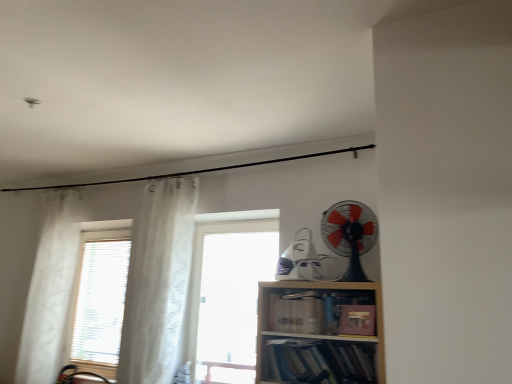
What is the approximate height of matte cardboard book at center-right, the 2th book in the bottom-to-top sequence?

matte cardboard book at center-right, the 2th book in the bottom-to-top sequence, is 8.81 inches in height.

Image resolution: width=512 pixels, height=384 pixels. Describe the element at coordinates (357, 320) in the screenshot. I see `brown leather book at lower right, positioned as the 3th book in bottom-to-top order` at that location.

Describe the element at coordinates (158, 281) in the screenshot. Image resolution: width=512 pixels, height=384 pixels. I see `white sheer curtain at left, arranged as the second curtain when viewed from the left` at that location.

You are a GUI agent. You are given a task and a screenshot of the screen. Output one action in this format:
    pyautogui.click(x=<x>, y=<y>)
    Task: Click on the transparent glass window at center
    Image resolution: width=512 pixels, height=384 pixels.
    Given the screenshot: What is the action you would take?
    pyautogui.click(x=228, y=297)

Measure the distance from white sheer curtain at left, arranged as the second curtain when viewed from the left, to black plastic fan at upper right.

white sheer curtain at left, arranged as the second curtain when viewed from the left, and black plastic fan at upper right are 1.28 meters apart.

In the scene shown: Considering the relative sizes of white sheer curtain at left, which is counted as the first curtain, starting from the right, and black plastic fan at upper right in the image provided, is white sheer curtain at left, which is counted as the first curtain, starting from the right, shorter than black plastic fan at upper right?

No.

Is white sheer curtain at left, which is counted as the first curtain, starting from the right, closer to camera compared to black plastic fan at upper right?

No, white sheer curtain at left, which is counted as the first curtain, starting from the right, is further to the viewer.

Are white sheer curtain at left, which is counted as the first curtain, starting from the right, and black plastic fan at upper right beside each other?

white sheer curtain at left, which is counted as the first curtain, starting from the right, is not next to black plastic fan at upper right, and they're not touching.

Considering the relative sizes of transparent glass window at center and matte cardboard book at center-right, the 2th book in the bottom-to-top sequence, in the image provided, is transparent glass window at center shorter than matte cardboard book at center-right, the 2th book in the bottom-to-top sequence,?

Incorrect, the height of transparent glass window at center does not fall short of that of matte cardboard book at center-right, the 2th book in the bottom-to-top sequence.

Between transparent glass window at center and matte cardboard book at center-right, the 2th book in the bottom-to-top sequence, which one has smaller size?

matte cardboard book at center-right, the 2th book in the bottom-to-top sequence.

Is transparent glass window at center not near matte cardboard book at center-right, the 2th book in the top-to-bottom sequence?

transparent glass window at center is positioned a significant distance from matte cardboard book at center-right, the 2th book in the top-to-bottom sequence.

From a real-world perspective, is transparent glass window at center positioned over matte cardboard book at center-right, the 2th book in the bottom-to-top sequence, based on gravity?

Yes, from a real-world perspective, transparent glass window at center is on top of matte cardboard book at center-right, the 2th book in the bottom-to-top sequence.

Where is `mechanical fan above the white sheer curtain at left, the 2th curtain viewed from the right (from a real-world perspective)`? mechanical fan above the white sheer curtain at left, the 2th curtain viewed from the right (from a real-world perspective) is located at coordinates 350,235.

Relative to white sheer curtain at left, the 2th curtain viewed from the right, is black plastic fan at upper right in front or behind?

black plastic fan at upper right is positioned closer to the viewer than white sheer curtain at left, the 2th curtain viewed from the right.

Is black plastic fan at upper right bigger than white sheer curtain at left, the 2th curtain viewed from the right?

No, black plastic fan at upper right is not bigger than white sheer curtain at left, the 2th curtain viewed from the right.

Is point (359, 280) farther from camera compared to point (384, 381)?

Yes, point (359, 280) is behind point (384, 381).

From the image's perspective, would you say black plastic fan at upper right is shown under wooden bookshelf at center?

Incorrect, from the image's perspective, black plastic fan at upper right is higher than wooden bookshelf at center.

Between black plastic fan at upper right and wooden bookshelf at center, which one appears on the left side from the viewer's perspective?

Positioned to the left is wooden bookshelf at center.

From a real-world perspective, which is physically above, transparent glass window at center or brown leather book at lower right, acting as the 1th book starting from the top?

In real-world perspective, transparent glass window at center is above.

Can you confirm if transparent glass window at center is positioned to the right of brown leather book at lower right, acting as the 1th book starting from the top?

No, transparent glass window at center is not to the right of brown leather book at lower right, acting as the 1th book starting from the top.

Is transparent glass window at center next to brown leather book at lower right, positioned as the 3th book in bottom-to-top order, and touching it?

No, transparent glass window at center is not next to brown leather book at lower right, positioned as the 3th book in bottom-to-top order.

Considering their positions, is matte cardboard book at center-right, the 2th book in the bottom-to-top sequence, located in front of or behind black plastic fan at upper right?

Clearly, matte cardboard book at center-right, the 2th book in the bottom-to-top sequence, is in front of black plastic fan at upper right.

Can black plastic fan at upper right be found inside matte cardboard book at center-right, the 2th book in the bottom-to-top sequence?

No, black plastic fan at upper right is not a part of matte cardboard book at center-right, the 2th book in the bottom-to-top sequence.

Is matte cardboard book at center-right, the 2th book in the top-to-bottom sequence, positioned with its back to black plastic fan at upper right?

That's not correct — matte cardboard book at center-right, the 2th book in the top-to-bottom sequence, is not looking away from black plastic fan at upper right.

This screenshot has height=384, width=512. I want to click on mechanical fan behind the matte cardboard book at center-right, the 2th book in the bottom-to-top sequence, so click(x=350, y=235).

Does transparent glass window at center have a lesser width compared to black plastic fan at upper right?

Correct, the width of transparent glass window at center is less than that of black plastic fan at upper right.

This screenshot has height=384, width=512. Find the location of `window below the black plastic fan at upper right (from the image's perspective)`. window below the black plastic fan at upper right (from the image's perspective) is located at coordinates (228, 297).

Which object is positioned more to the right, transparent glass window at center or black plastic fan at upper right?

From the viewer's perspective, black plastic fan at upper right appears more on the right side.

Which of these two, transparent glass window at center or black plastic fan at upper right, stands shorter?

With less height is black plastic fan at upper right.

Starting from the black plastic fan at upper right, which curtain is the 1st one behind? Please provide its 2D coordinates.

[(158, 281)]

From the transparent glass window at center, count 1st books forward and point to it. Please provide its 2D coordinates.

[(323, 313)]

From the image, which object appears to be farther from matte cardboard book at center-right, the 2th book in the bottom-to-top sequence, white sheer curtain at left, positioned as the first curtain in left-to-right order, or white sheer curtain at left, which is counted as the first curtain, starting from the right?

white sheer curtain at left, positioned as the first curtain in left-to-right order, lies further to matte cardboard book at center-right, the 2th book in the bottom-to-top sequence, than the other object.

Estimate the real-world distances between objects in this image. Which object is further from transparent glass window at center, wooden bookshelf at center or matte cardboard book at center-right, the 2th book in the bottom-to-top sequence?

The object further to transparent glass window at center is matte cardboard book at center-right, the 2th book in the bottom-to-top sequence.

From the image, which object appears to be farther from black plastic fan at upper right, wooden bookshelf at center or transparent glass window at center?

Based on the image, transparent glass window at center appears to be further to black plastic fan at upper right.

Considering their positions, is white sheer curtain at left, which is counted as the first curtain, starting from the right, positioned closer to matte cardboard book at center-right, the 2th book in the bottom-to-top sequence, than hardcover books at lower center, the 3th book from the top?

hardcover books at lower center, the 3th book from the top.

In the scene shown: Which object lies nearer to the anchor point white sheer curtain at left, arranged as the second curtain when viewed from the left, white sheer curtain at left, the 2th curtain viewed from the right, or black plastic fan at upper right?

white sheer curtain at left, the 2th curtain viewed from the right.

Based on their spatial positions, is black plastic fan at upper right or wooden bookshelf at center further from white sheer curtain at left, arranged as the second curtain when viewed from the left?

black plastic fan at upper right lies further to white sheer curtain at left, arranged as the second curtain when viewed from the left, than the other object.

Looking at the image, which one is located further to white sheer curtain at left, the 2th curtain viewed from the right, black plastic fan at upper right or brown leather book at lower right, positioned as the 3th book in bottom-to-top order?

brown leather book at lower right, positioned as the 3th book in bottom-to-top order, is positioned further to the anchor white sheer curtain at left, the 2th curtain viewed from the right.

Which object lies nearer to the anchor point black plastic fan at upper right, white sheer curtain at left, arranged as the second curtain when viewed from the left, or matte cardboard book at center-right, the 2th book in the bottom-to-top sequence?

matte cardboard book at center-right, the 2th book in the bottom-to-top sequence, lies closer to black plastic fan at upper right than the other object.

The image size is (512, 384). I want to click on bookcase between transparent glass window at center and black plastic fan at upper right, so click(320, 333).

At what (x,y) coordinates should I click in order to perform the action: click on window between white sheer curtain at left, arranged as the second curtain when viewed from the left, and hardcover books at lower center, the 3th book from the top, from left to right. Please return your answer as a coordinate pair (x, y). The image size is (512, 384). Looking at the image, I should click on (228, 297).

Identify the location of bookcase between transparent glass window at center and brown leather book at lower right, acting as the 1th book starting from the top, in the horizontal direction. This screenshot has width=512, height=384. (320, 333).

This screenshot has height=384, width=512. What are the coordinates of `bookcase between white sheer curtain at left, positioned as the first curtain in left-to-right order, and matte cardboard book at center-right, the 2th book in the top-to-bottom sequence` in the screenshot? It's located at (320, 333).